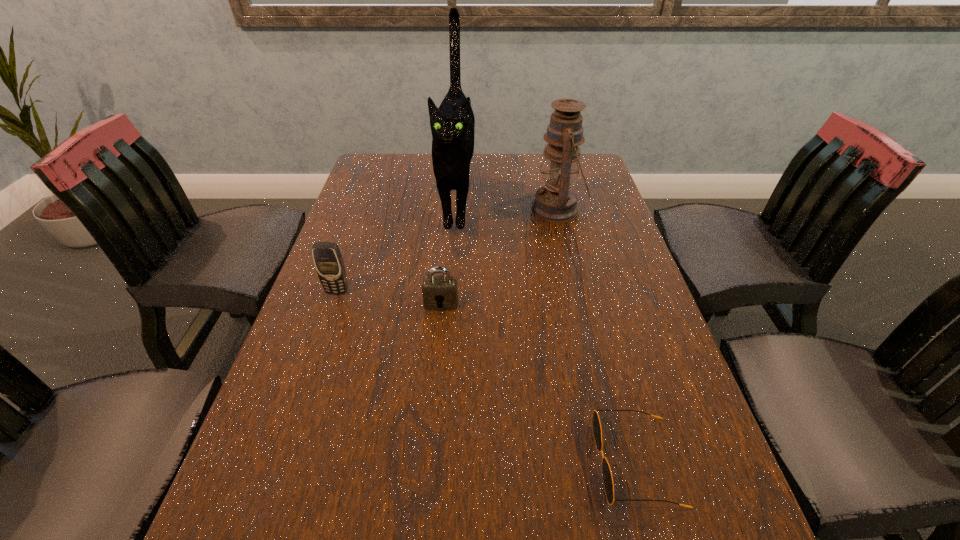
Find the location of `the tallest object`. the tallest object is located at coordinates click(452, 124).

Identify the location of oil lamp. This screenshot has height=540, width=960. (556, 202).

At what (x,y) coordinates should I click in order to perform the action: click on the third farthest object. Please return your answer as a coordinate pair (x, y). Looking at the image, I should click on tap(328, 261).

Locate an element on the screen. The height and width of the screenshot is (540, 960). cellular telephone is located at coordinates 328,261.

The width and height of the screenshot is (960, 540). What are the coordinates of `the fourth tallest object` in the screenshot? It's located at click(x=440, y=292).

Where is `padlock`? This screenshot has width=960, height=540. padlock is located at coordinates (440, 292).

Locate an element on the screen. the nearest object is located at coordinates (596, 425).

Image resolution: width=960 pixels, height=540 pixels. I want to click on the shortest object, so click(596, 425).

Find the location of a particular element. The width and height of the screenshot is (960, 540). vacant space situated 0.250m on the face of the tallest object is located at coordinates (448, 318).

Identify the location of vacant area situated 0.090m on the back of the second tallest object. This screenshot has height=540, width=960. (550, 176).